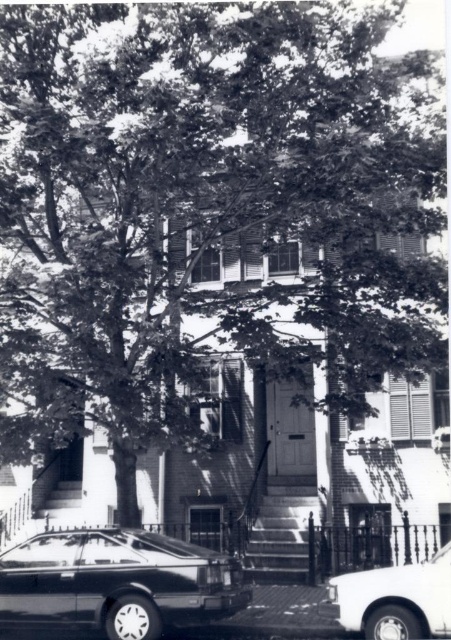
Question: Which of the following is the closest to the observer?

Choices:
 (A) (90, 566)
 (B) (358, 600)

Answer: (B)

Question: Which of the following is the closest to the observer?

Choices:
 (A) (194, 598)
 (B) (423, 616)

Answer: (B)

Question: Is shiny black sedan at lower left positioned behind white glossy sedan at lower right?

Choices:
 (A) yes
 (B) no

Answer: (A)

Question: Does shiny black sedan at lower left appear over white glossy sedan at lower right?

Choices:
 (A) yes
 (B) no

Answer: (B)

Question: Can you confirm if shiny black sedan at lower left is wider than white glossy sedan at lower right?

Choices:
 (A) yes
 (B) no

Answer: (A)